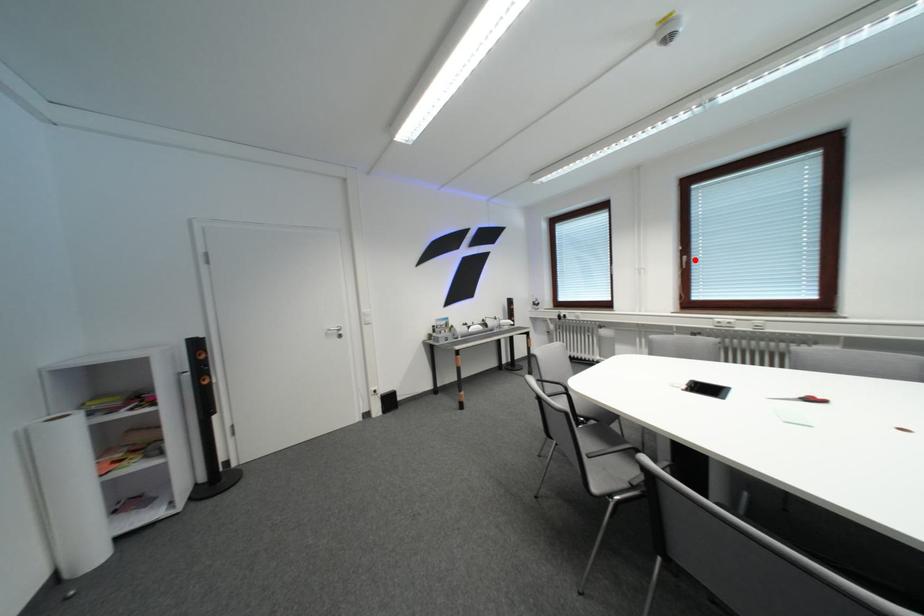
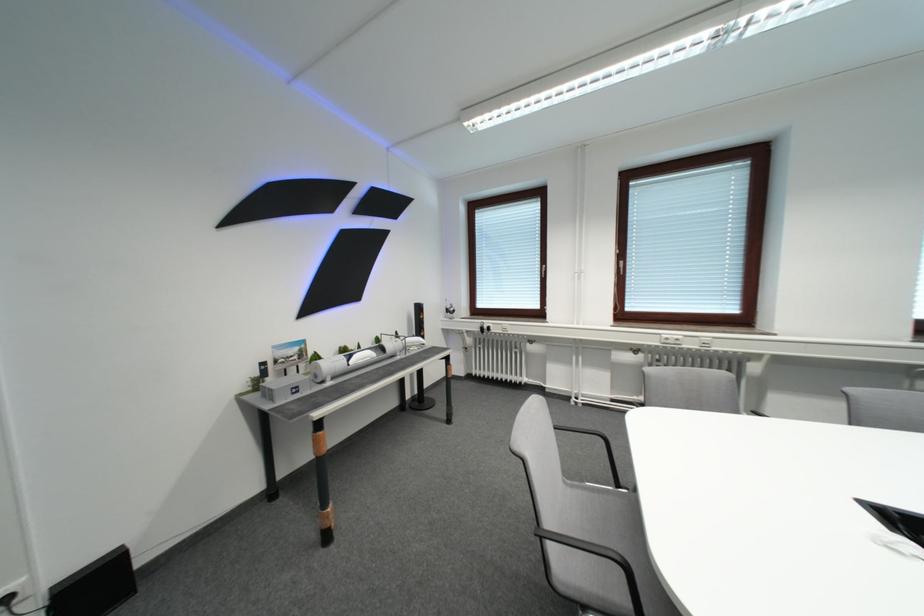
The point at the highlighted location is marked in the first image. Where is the corresponding point in the second image?

(631, 265)